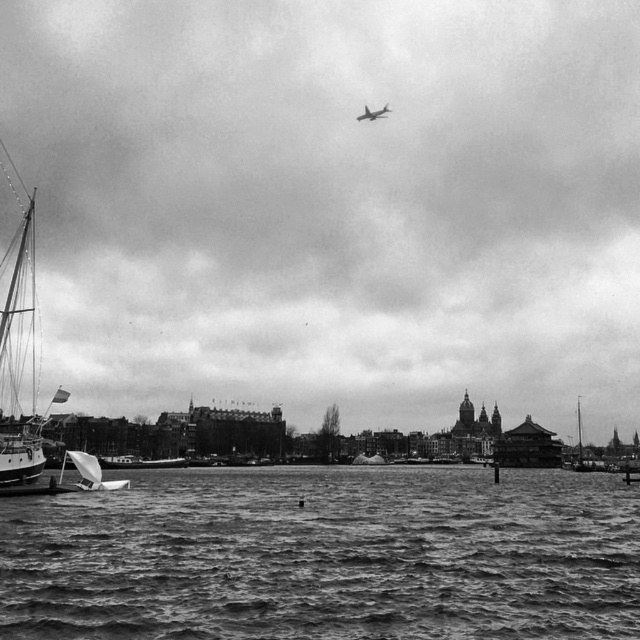
Is the position of white plastic sailboat at lower left less distant than that of metallic silver airplane at upper center?

Yes, it is in front of metallic silver airplane at upper center.

Which is in front, point (74, 452) or point (381, 115)?

Positioned in front is point (74, 452).

Where is `white plastic sailboat at lower left`? The height and width of the screenshot is (640, 640). white plastic sailboat at lower left is located at coordinates (90, 472).

Based on the photo, which is more to the left, rough textured water at lower center or smooth white boat at lower left?

Positioned to the left is smooth white boat at lower left.

Can you confirm if rough textured water at lower center is shorter than smooth white boat at lower left?

Incorrect, rough textured water at lower center's height does not fall short of smooth white boat at lower left's.

This screenshot has width=640, height=640. What do you see at coordinates (324, 556) in the screenshot?
I see `rough textured water at lower center` at bounding box center [324, 556].

At what (x,y) coordinates should I click in order to perform the action: click on rough textured water at lower center. Please return your answer as a coordinate pair (x, y). The image size is (640, 640). Looking at the image, I should click on (324, 556).

Does white plastic sailboat at lower left have a lesser width compared to white matte sailboat at right?

Correct, white plastic sailboat at lower left's width is less than white matte sailboat at right's.

Looking at this image, does white plastic sailboat at lower left come in front of white matte sailboat at right?

That is True.

Who is more distant from viewer, [72,451] or [580,442]?

Point [580,442]

This screenshot has height=640, width=640. I want to click on white plastic sailboat at lower left, so click(x=90, y=472).